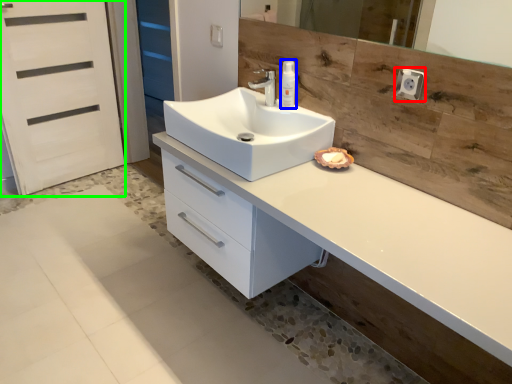
Question: Which object is positioned closest to knob (highlighted by a red box)? Select from soap dispenser (highlighted by a blue box) and screen door (highlighted by a green box).

Choices:
 (A) soap dispenser
 (B) screen door

Answer: (A)